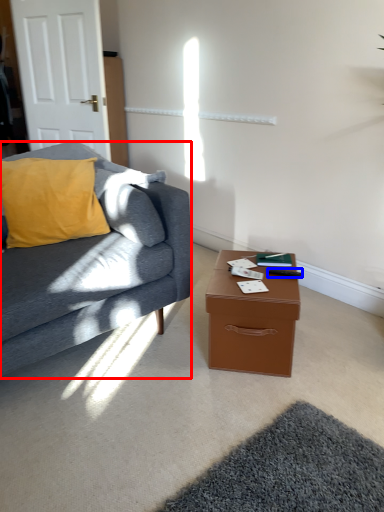
Question: Among these objects, which one is farthest to the camera, studio couch (highlighted by a red box) or remote control (highlighted by a blue box)?

Choices:
 (A) studio couch
 (B) remote control

Answer: (B)